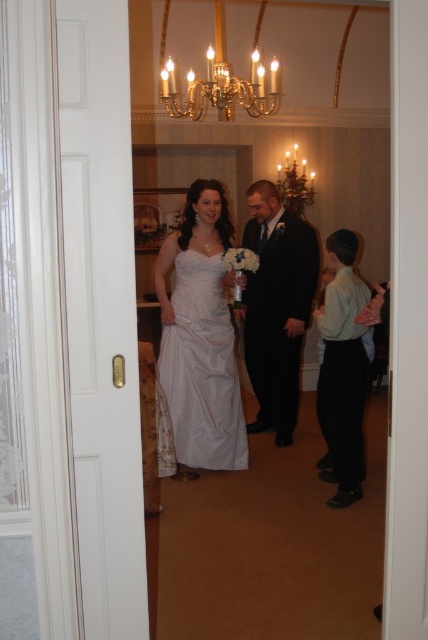
You are a photographer positioned at the doorway capturing the wedding scene. You want to ensure both the white satin dress at center and the black satin suit at center are in focus. Given that your camera has a depth of field that can cover 25 inches, will both subjects be in focus?

The white satin dress at center and the black satin suit at center are 26.10 inches apart. Since the camera can only cover 25 inches, they are slightly out of the depth of field range, so both may not be fully in focus.

You are a photographer setting up for the wedding photos. You need to position a backdrop that is 2 meters wide behind the white satin dress at center and the black satin suit at right. Considering their widths, will the backdrop be wide enough to cover both?

The white satin dress at center might be wider than black satin suit at right, so the total width required could be more than 2 meters. Therefore, the backdrop might not be wide enough to cover both.